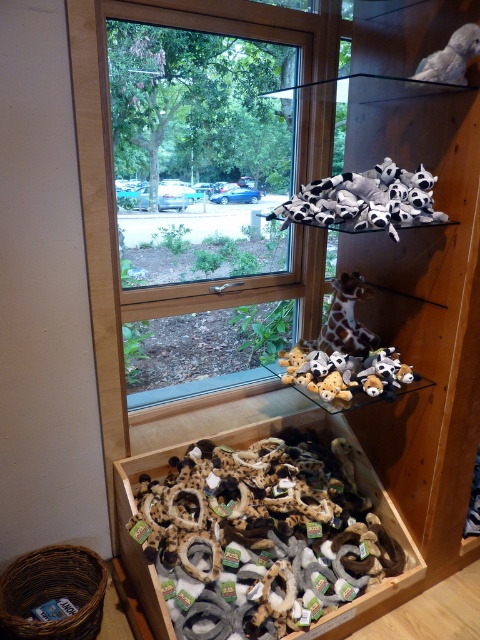
You are organizing a toy store and need to place the soft plush toys at lower center and the spotted fur plush at upper center on shelves. Given their sizes, which one requires a taller shelf?

The soft plush toys at lower center requires a taller shelf because they have a greater height compared to the spotted fur plush at upper center.

You are a delivery person trying to place a package between the clear glass window at upper center and the black plush toys at upper center. The package is 28 inches long. Will it fit in the space between them?

The clear glass window at upper center and black plush toys at upper center are 28.25 inches apart. Since the package is 28 inches long, it will fit with a small amount of space remaining.